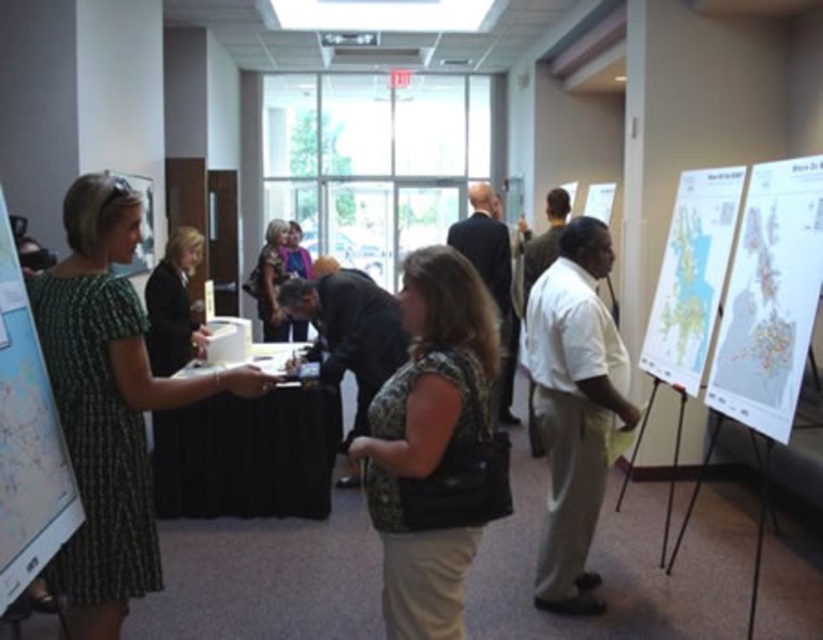
Is point (770, 236) positioned before point (607, 184)?

Yes, it is in front of point (607, 184).

This screenshot has height=640, width=823. In order to click on white paper map at right in this screenshot , I will do `click(770, 298)`.

Can you confirm if green fabric map at left is thinner than matte black poster at upper left?

No.

Which is behind, point (0, 289) or point (143, 218)?

The point (143, 218) is behind.

Is point (0, 516) farther from viewer compared to point (133, 273)?

No, (0, 516) is closer to viewer.

Where is `green fabric map at left`? green fabric map at left is located at coordinates (26, 440).

Which is in front, point (394, 426) or point (691, 308)?

Positioned in front is point (394, 426).

Who is higher up, camouflage-patterned blouse at center or map paper at right?

map paper at right is above.

Does point (419, 298) come behind point (673, 349)?

No, (419, 298) is closer to viewer.

Locate an element on the screen. Image resolution: width=823 pixels, height=640 pixels. camouflage-patterned blouse at center is located at coordinates (430, 440).